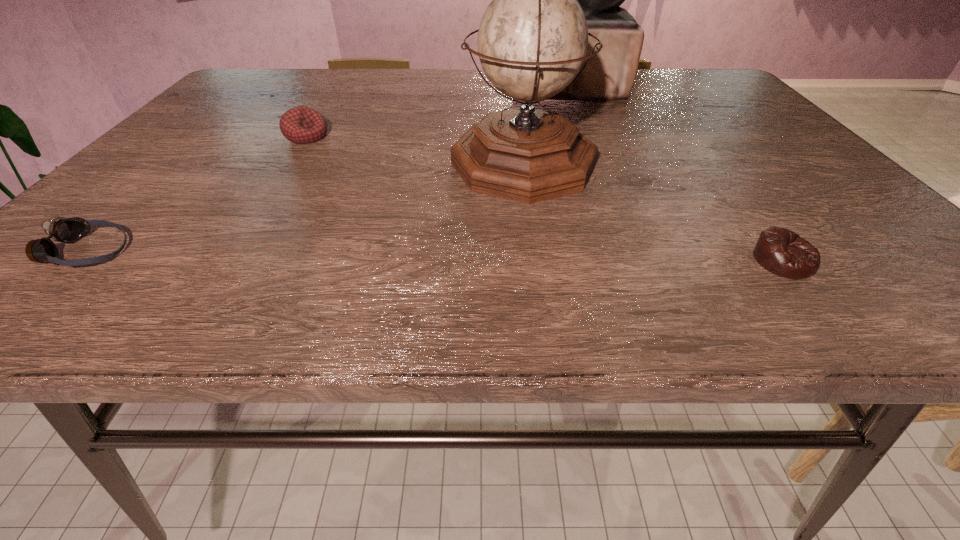
Locate an element on the screen. object located in the left edge section of the desktop is located at coordinates (60, 229).

Image resolution: width=960 pixels, height=540 pixels. Find the location of `object situated at the near left corner`. object situated at the near left corner is located at coordinates (60, 229).

The image size is (960, 540). I want to click on free space at the far edge of the desktop, so click(x=350, y=90).

Identify the location of vacant region at the near edge. The width and height of the screenshot is (960, 540). (252, 313).

Locate an element on the screen. free space at the left edge is located at coordinates (148, 245).

You are a GUI agent. You are given a task and a screenshot of the screen. Output one action in this format:
    pyautogui.click(x=<x>, y=<y>)
    Task: Click on the free space at the right edge of the desktop
    The width and height of the screenshot is (960, 540).
    Given the screenshot: What is the action you would take?
    pyautogui.click(x=820, y=189)

Image resolution: width=960 pixels, height=540 pixels. I want to click on vacant space at the far right corner of the desktop, so click(x=731, y=94).

The height and width of the screenshot is (540, 960). In the image, there is a desktop. Find the location of `free space at the near right corner`. free space at the near right corner is located at coordinates (897, 293).

Locate an element on the screen. This screenshot has height=540, width=960. vacant area that lies between the goggles and the globe is located at coordinates (305, 208).

In order to click on free point between the fourth shortest object and the shorter beanbag in this screenshot , I will do point(654,212).